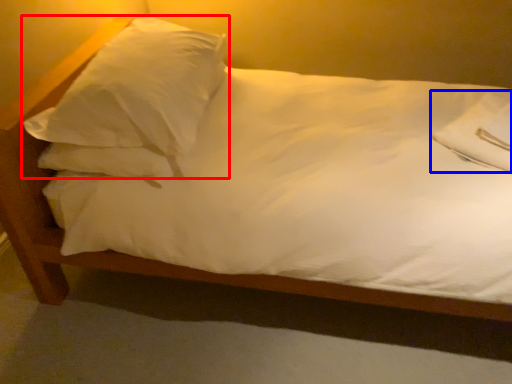
Question: Which object is closer to the camera taking this photo, pillow (highlighted by a red box) or pillow (highlighted by a blue box)?

Choices:
 (A) pillow
 (B) pillow

Answer: (A)